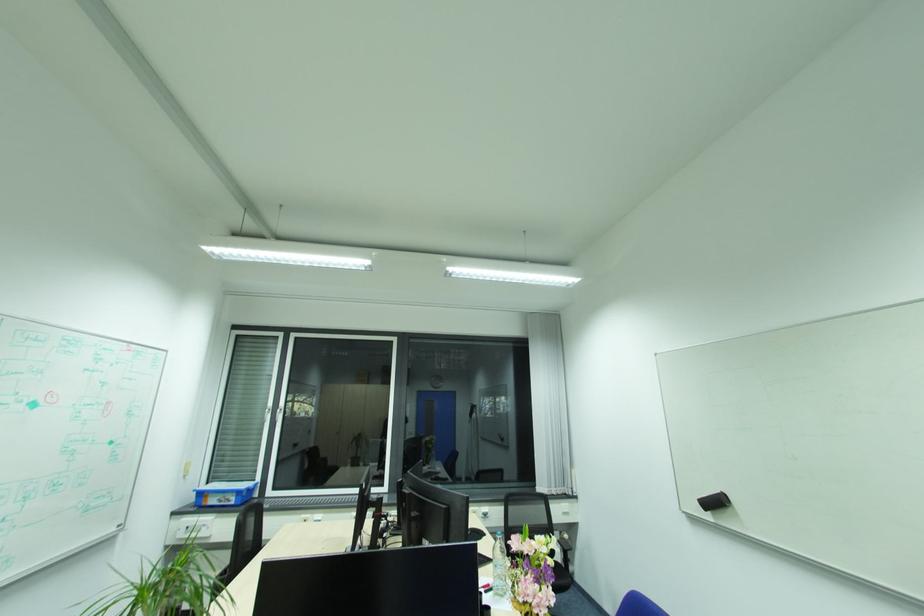
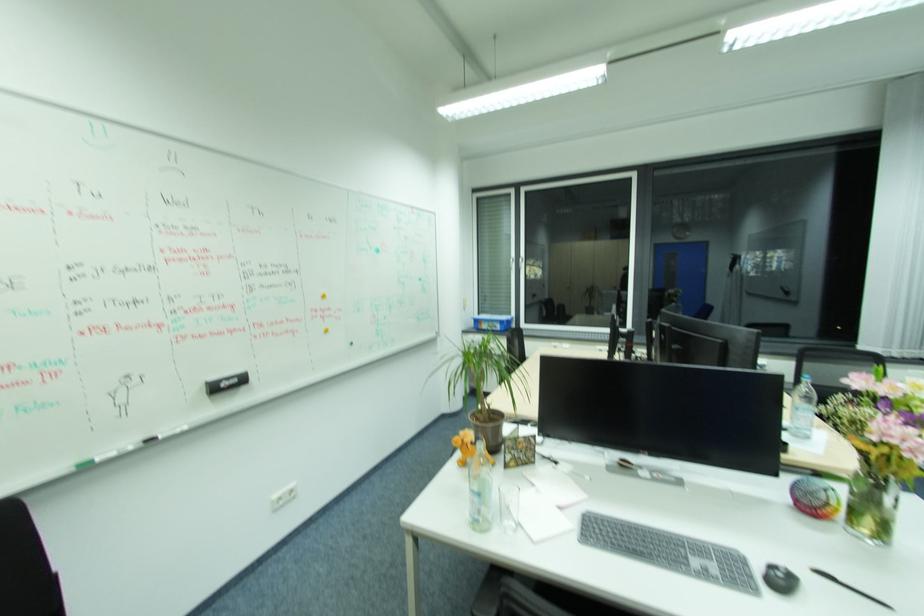
Question: I am providing you with two images of the same scene from different viewpoints. Please identify which objects are invisible in image2.

Choices:
 (A) chair sitting surface
 (B) clear glass bottle
 (C) whiteboard marker
 (D) none of these

Answer: (D)